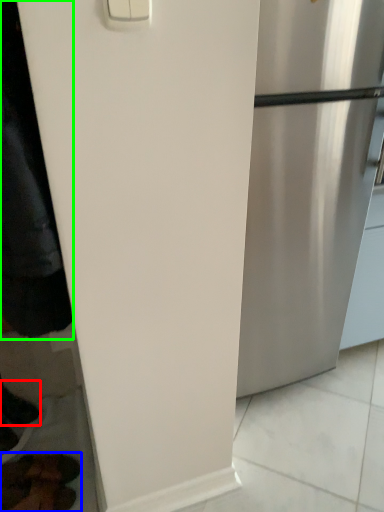
Question: Which object is positioned closest to shoe (highlighted by a red box)? Select from footwear (highlighted by a blue box) and jacket (highlighted by a green box).

Choices:
 (A) footwear
 (B) jacket

Answer: (A)